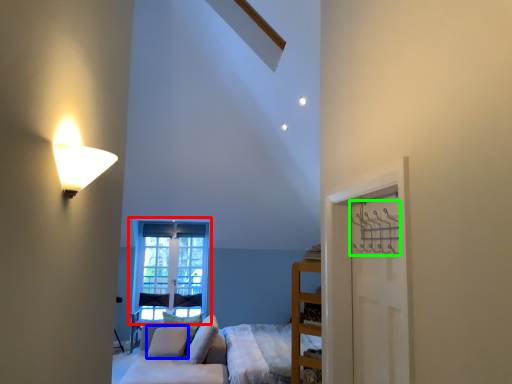
Question: Considering the real-world distances, which object is closest to window (highlighted by a red box)? pillow (highlighted by a blue box) or hanger (highlighted by a green box).

Choices:
 (A) pillow
 (B) hanger

Answer: (A)